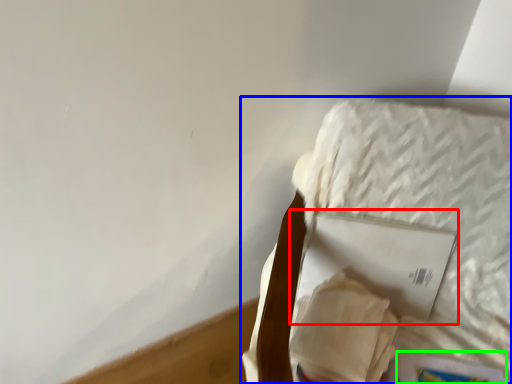
Question: Estimate the real-world distances between objects in this image. Which object is closer to paperback book (highlighted by a red box), furniture (highlighted by a blue box) or paperback book (highlighted by a green box)?

Choices:
 (A) furniture
 (B) paperback book

Answer: (A)